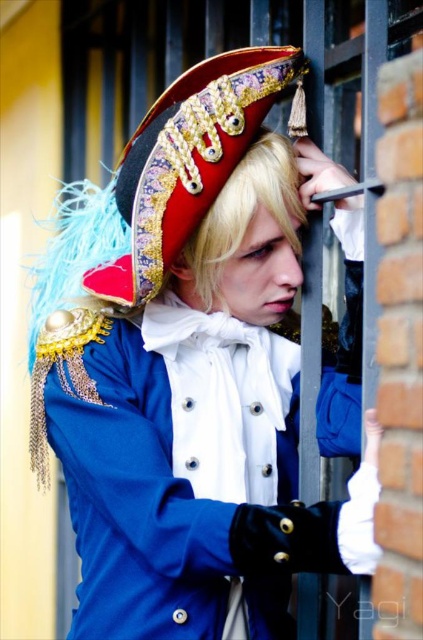
You are a photographer trying to capture the shiny gold and velvet hat at center and the blonde hair at center in a single shot. Which object should you focus on first to ensure both are in focus?

You should focus on the shiny gold and velvet hat at center first because it is closer to the viewer than the blonde hair at center, ensuring both will be in focus when focusing on the closer object.

You are an event planner organizing a historical reenactment. You need to place a small decorative flag exactly at the point marked as point (186,161). Based on the scene, where should you place the flag?

The point (186,161) is located on the shiny gold and velvet hat at center, so you should place the flag on the shiny gold and velvet hat at center.